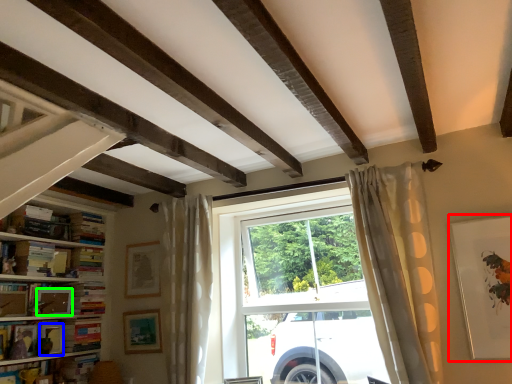
Question: Based on their relative distances, which object is nearer to picture frame (highlighted by a red box)? Choose from picture frame (highlighted by a blue box) and picture frame (highlighted by a green box).

Choices:
 (A) picture frame
 (B) picture frame

Answer: (B)